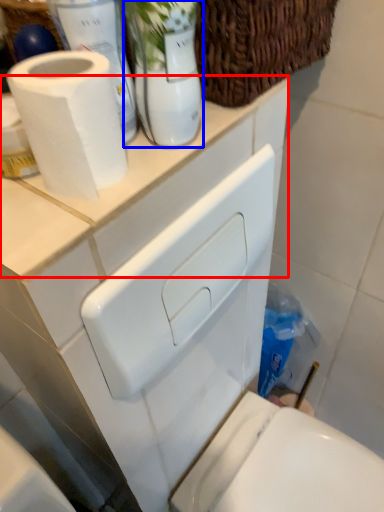
Question: Which object is closer to the camera taking this photo, counter top (highlighted by a red box) or glass vase (highlighted by a blue box)?

Choices:
 (A) counter top
 (B) glass vase

Answer: (B)